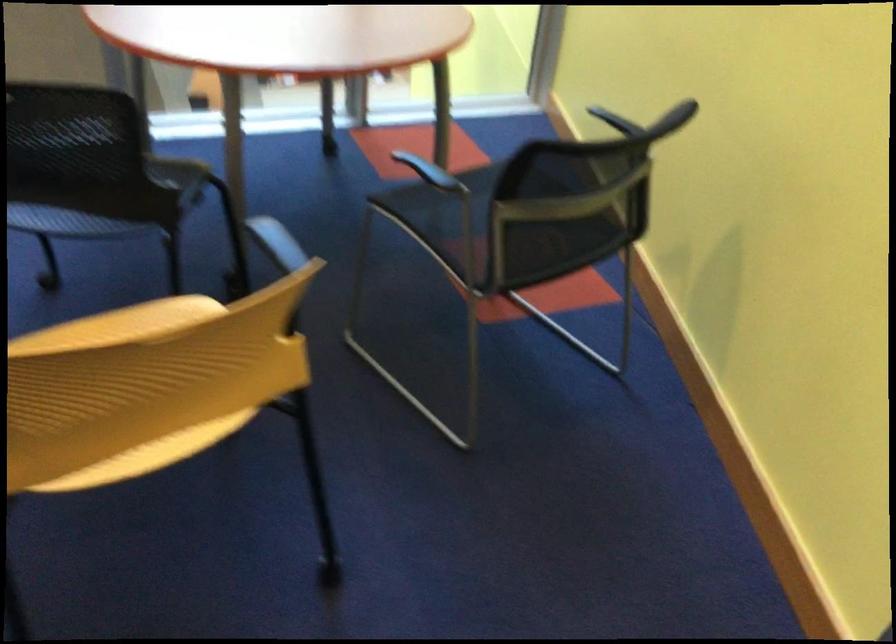
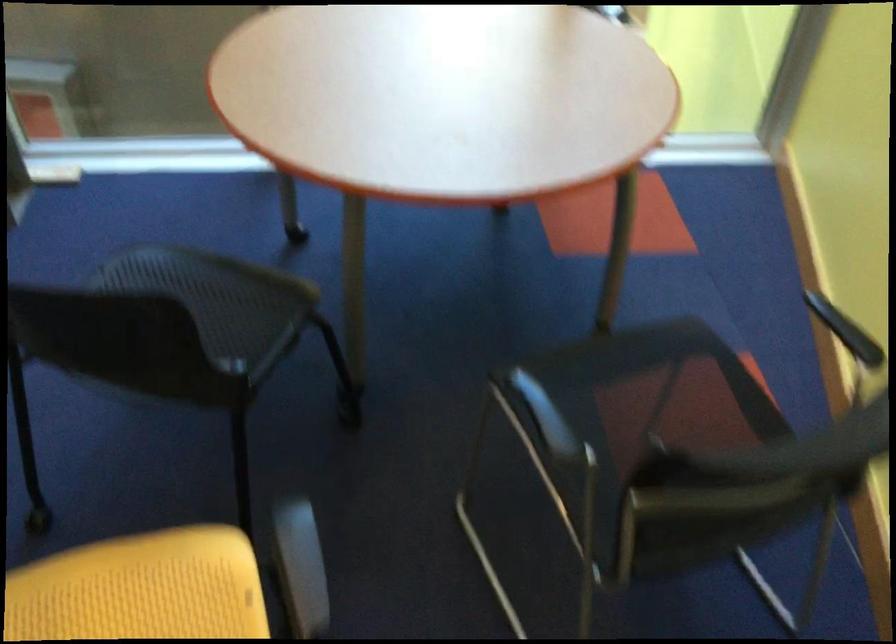
Question: What movement of the cameraman would produce the second image?

Choices:
 (A) Left
 (B) Right
 (C) Forward
 (D) Backward

Answer: (C)